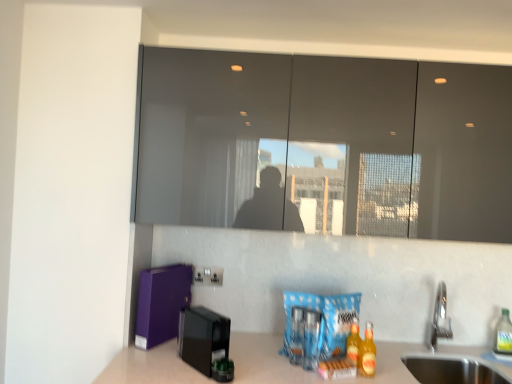
Question: In which direction should I rotate to look at translucent plastic bottle at center, which is counted as the second beverage, starting from the back?

Choices:
 (A) right
 (B) left

Answer: (A)

Question: From a real-world perspective, is stainless steel sink at lower right, which is the first sink from bottom to top, over matte gray mirror at upper center?

Choices:
 (A) yes
 (B) no

Answer: (B)

Question: Is stainless steel sink at lower right, which ranks as the 2th sink in top-to-bottom order, directly adjacent to matte gray mirror at upper center?

Choices:
 (A) yes
 (B) no

Answer: (B)

Question: Does stainless steel sink at lower right, which is the first sink from bottom to top, have a larger size compared to matte gray mirror at upper center?

Choices:
 (A) yes
 (B) no

Answer: (B)

Question: Can you confirm if stainless steel sink at lower right, which ranks as the 2th sink in top-to-bottom order, is thinner than matte gray mirror at upper center?

Choices:
 (A) yes
 (B) no

Answer: (B)

Question: Can you confirm if stainless steel sink at lower right, which is the first sink from bottom to top, is shorter than matte gray mirror at upper center?

Choices:
 (A) no
 (B) yes

Answer: (B)

Question: Does stainless steel sink at lower right, which ranks as the 2th sink in top-to-bottom order, appear on the right side of matte gray mirror at upper center?

Choices:
 (A) yes
 (B) no

Answer: (A)

Question: From the image's perspective, does black plastic coffee machine at lower left appear higher than stainless steel sink at lower right, which is the first sink from bottom to top?

Choices:
 (A) no
 (B) yes

Answer: (B)

Question: From a real-world perspective, does black plastic coffee machine at lower left sit lower than stainless steel sink at lower right, which is the first sink from bottom to top?

Choices:
 (A) yes
 (B) no

Answer: (B)

Question: Is the depth of black plastic coffee machine at lower left greater than that of stainless steel sink at lower right, which ranks as the 2th sink in top-to-bottom order?

Choices:
 (A) no
 (B) yes

Answer: (A)

Question: Is black plastic coffee machine at lower left wider than stainless steel sink at lower right, which ranks as the 2th sink in top-to-bottom order?

Choices:
 (A) no
 (B) yes

Answer: (A)

Question: Is black plastic coffee machine at lower left facing away from stainless steel sink at lower right, which is the first sink from bottom to top?

Choices:
 (A) no
 (B) yes

Answer: (A)

Question: Is black plastic coffee machine at lower left directly adjacent to stainless steel sink at lower right, which is the first sink from bottom to top?

Choices:
 (A) yes
 (B) no

Answer: (B)

Question: From the image's perspective, is black plastic coffee machine at lower left on matte gray mirror at upper center?

Choices:
 (A) yes
 (B) no

Answer: (B)